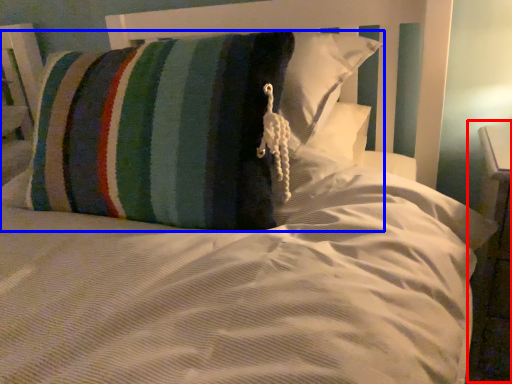
Question: Which of the following is the closest to the observer, dresser (highlighted by a red box) or pillow (highlighted by a blue box)?

Choices:
 (A) dresser
 (B) pillow

Answer: (B)